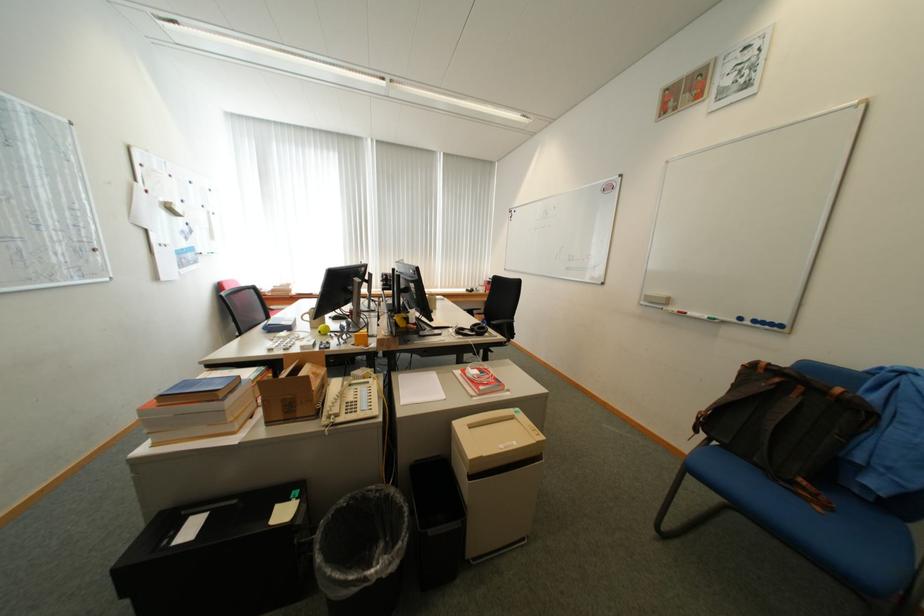
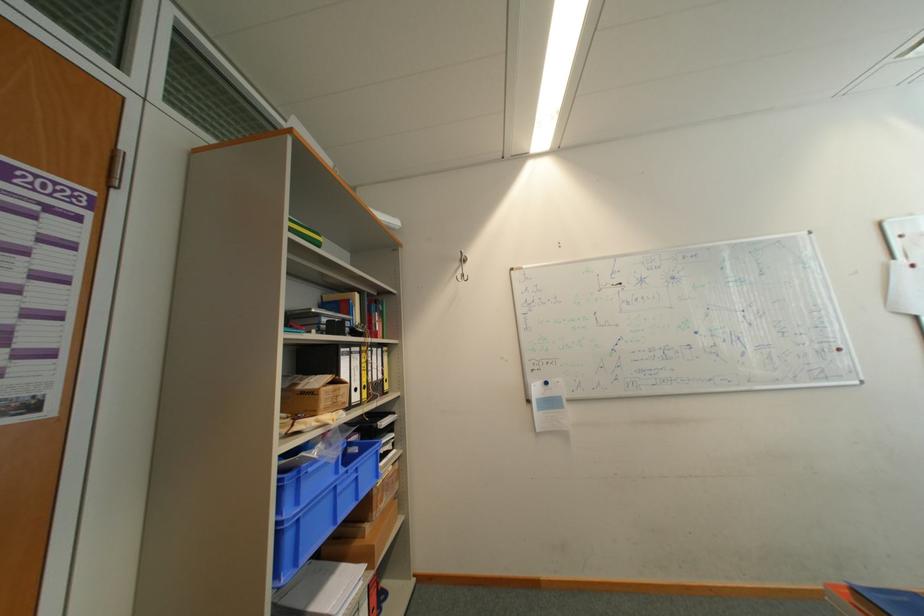
Question: The camera is either moving clockwise (left) or counter-clockwise (right) around the object. The first image is from the beginning of the video and the second image is from the end. Is the camera moving left or right when shooting the video?

Choices:
 (A) Left
 (B) Right

Answer: (B)